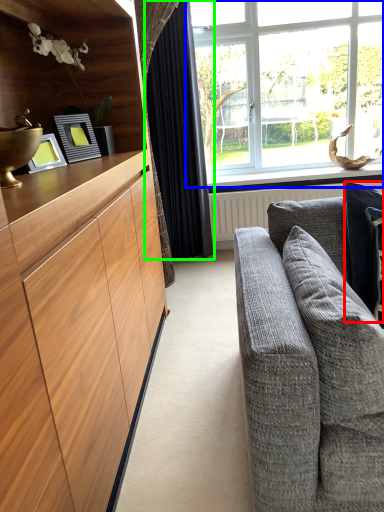
Question: Based on their relative distances, which object is farther from pillow (highlighted by a red box)? Choose from window (highlighted by a blue box) and curtain (highlighted by a green box).

Choices:
 (A) window
 (B) curtain

Answer: (A)